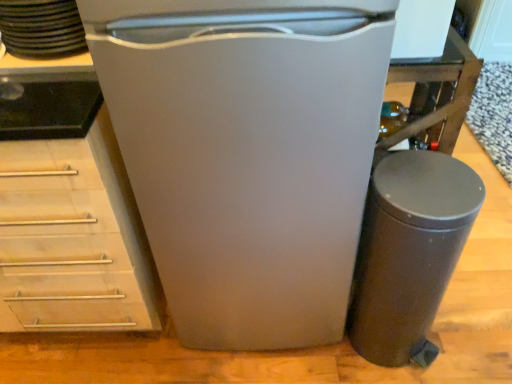
Question: From the image's perspective, is black matte stack of plates at upper left beneath matte black trash can at lower right?

Choices:
 (A) yes
 (B) no

Answer: (B)

Question: Is black matte stack of plates at upper left surrounding matte black trash can at lower right?

Choices:
 (A) no
 (B) yes

Answer: (A)

Question: Is black matte stack of plates at upper left thinner than matte black trash can at lower right?

Choices:
 (A) no
 (B) yes

Answer: (A)

Question: From a real-world perspective, does black matte stack of plates at upper left stand above matte black trash can at lower right?

Choices:
 (A) yes
 (B) no

Answer: (A)

Question: Can you confirm if black matte stack of plates at upper left is shorter than matte black trash can at lower right?

Choices:
 (A) no
 (B) yes

Answer: (B)

Question: Relative to black matte stack of plates at upper left, is white matte refrigerator at center in front or behind?

Choices:
 (A) behind
 (B) front

Answer: (B)

Question: Considering the positions of point (359, 97) and point (61, 13), is point (359, 97) closer or farther from the camera than point (61, 13)?

Choices:
 (A) closer
 (B) farther

Answer: (A)

Question: Is white matte refrigerator at center spatially inside black matte stack of plates at upper left, or outside of it?

Choices:
 (A) inside
 (B) outside

Answer: (B)

Question: From the image's perspective, is white matte refrigerator at center above or below black matte stack of plates at upper left?

Choices:
 (A) below
 (B) above

Answer: (A)

Question: From a real-world perspective, is white matte refrigerator at center above or below matte black trash can at lower right?

Choices:
 (A) above
 (B) below

Answer: (A)

Question: Is white matte refrigerator at center inside the boundaries of matte black trash can at lower right, or outside?

Choices:
 (A) inside
 (B) outside

Answer: (B)

Question: Considering the positions of white matte refrigerator at center and matte black trash can at lower right in the image, is white matte refrigerator at center wider or thinner than matte black trash can at lower right?

Choices:
 (A) thin
 (B) wide

Answer: (B)

Question: In terms of size, does white matte refrigerator at center appear bigger or smaller than matte black trash can at lower right?

Choices:
 (A) big
 (B) small

Answer: (A)

Question: Is black matte stack of plates at upper left inside or outside of matte black trash can at lower right?

Choices:
 (A) inside
 (B) outside

Answer: (B)

Question: Considering the positions of black matte stack of plates at upper left and matte black trash can at lower right in the image, is black matte stack of plates at upper left taller or shorter than matte black trash can at lower right?

Choices:
 (A) short
 (B) tall

Answer: (A)